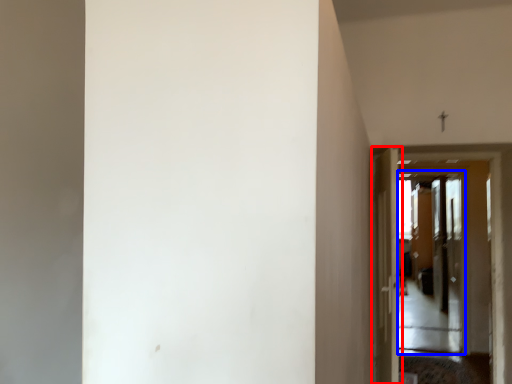
Question: Which of the following is the closest to the observer, door (highlighted by a red box) or screen door (highlighted by a blue box)?

Choices:
 (A) door
 (B) screen door

Answer: (A)